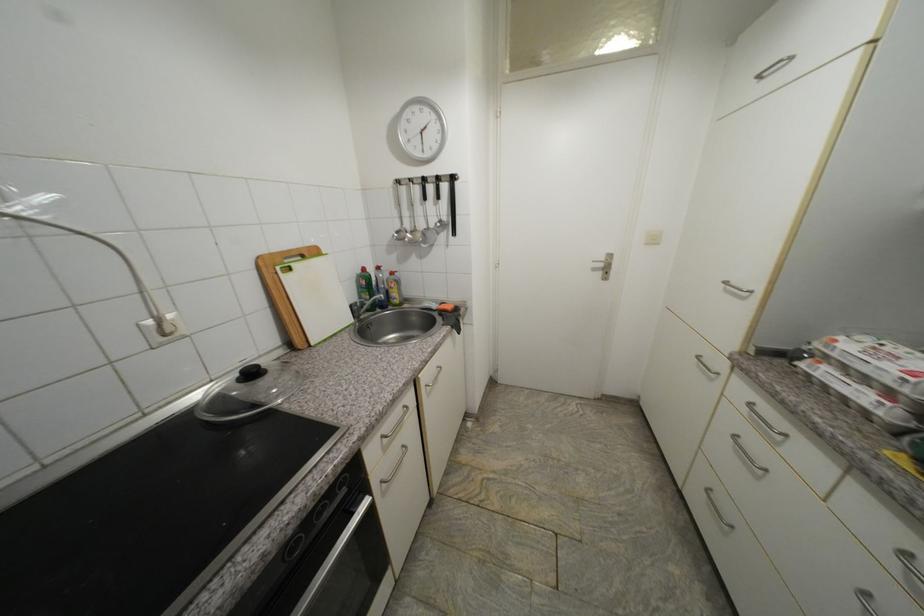
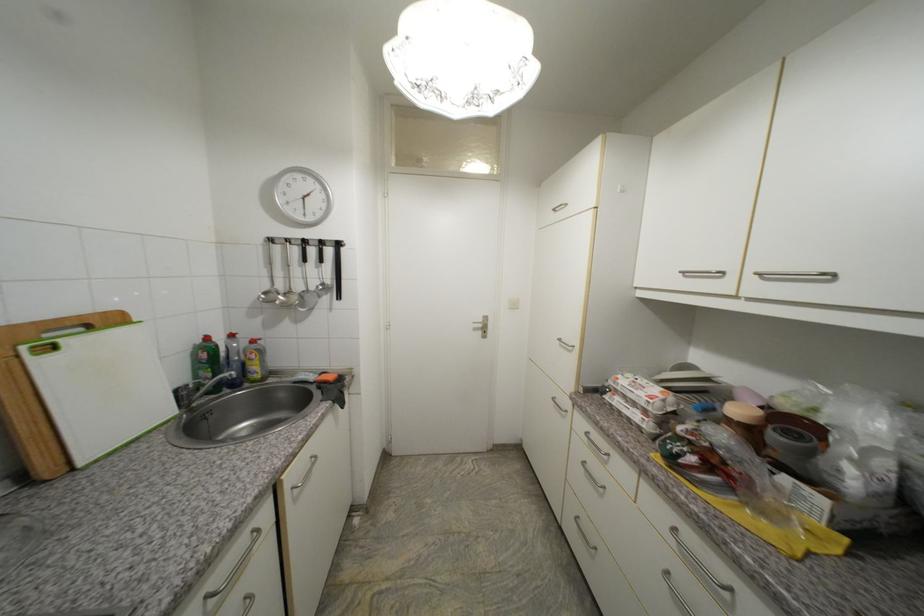
In the second image, find the point that corresponds to the point at 404,228 in the first image.

(273, 288)